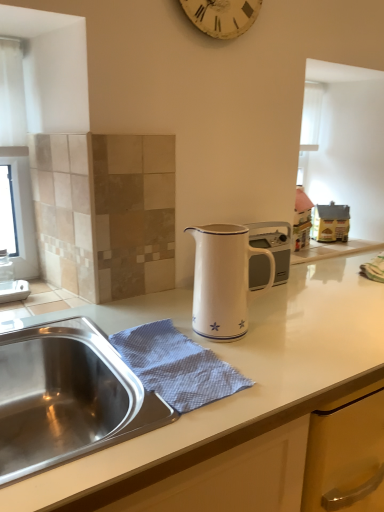
Question: Can you confirm if white textured clock at upper center is taller than blue textured cloth at sink?

Choices:
 (A) yes
 (B) no

Answer: (A)

Question: Can you confirm if white textured clock at upper center is positioned to the left of blue textured cloth at sink?

Choices:
 (A) no
 (B) yes

Answer: (A)

Question: Is white textured clock at upper center closer to camera compared to blue textured cloth at sink?

Choices:
 (A) no
 (B) yes

Answer: (A)

Question: Can you confirm if white textured clock at upper center is thinner than blue textured cloth at sink?

Choices:
 (A) no
 (B) yes

Answer: (B)

Question: Would you say white textured clock at upper center contains blue textured cloth at sink?

Choices:
 (A) yes
 (B) no

Answer: (B)

Question: Considering the relative positions of white enamel jug at center and blue textured cloth at sink in the image provided, is white enamel jug at center to the left or to the right of blue textured cloth at sink?

Choices:
 (A) right
 (B) left

Answer: (A)

Question: From a real-world perspective, is white enamel jug at center positioned above or below blue textured cloth at sink?

Choices:
 (A) below
 (B) above

Answer: (B)

Question: From the image's perspective, is white enamel jug at center located above or below blue textured cloth at sink?

Choices:
 (A) above
 (B) below

Answer: (A)

Question: Does point (241, 330) appear closer or farther from the camera than point (211, 388)?

Choices:
 (A) farther
 (B) closer

Answer: (A)

Question: Would you say blue textured cloth at sink is inside or outside white textured clock at upper center?

Choices:
 (A) inside
 (B) outside

Answer: (B)

Question: From a real-world perspective, is blue textured cloth at sink physically located above or below white textured clock at upper center?

Choices:
 (A) below
 (B) above

Answer: (A)

Question: In the image, is blue textured cloth at sink positioned in front of or behind white textured clock at upper center?

Choices:
 (A) behind
 (B) front

Answer: (B)

Question: Considering the relative positions of blue textured cloth at sink and white textured clock at upper center in the image provided, is blue textured cloth at sink to the left or to the right of white textured clock at upper center?

Choices:
 (A) left
 (B) right

Answer: (A)

Question: Is blue textured cloth at sink in front of or behind white enamel jug at center in the image?

Choices:
 (A) front
 (B) behind

Answer: (A)

Question: Considering the relative positions of blue textured cloth at sink and white enamel jug at center in the image provided, is blue textured cloth at sink to the left or to the right of white enamel jug at center?

Choices:
 (A) right
 (B) left

Answer: (B)